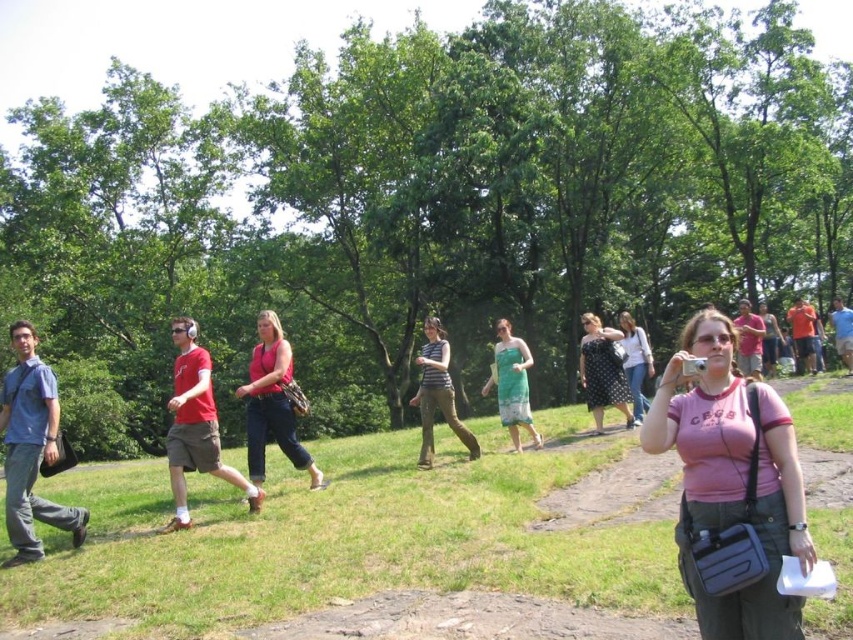
You are a photographer trying to capture a shot of the green grass at center and the pink cotton shirt at lower right. Which object would appear bigger in the photo?

The green grass at center would appear bigger in the photo because it has a larger size compared to the pink cotton shirt at lower right.